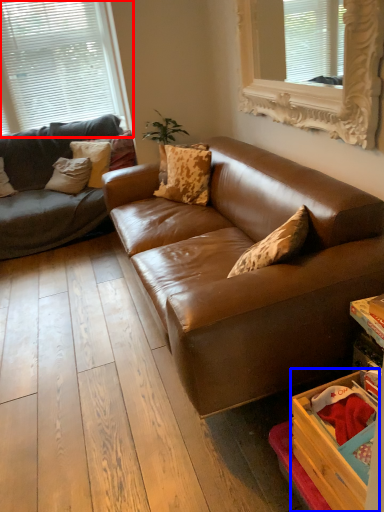
Question: Which of the following is the closest to the observer, window (highlighted by a red box) or drawer (highlighted by a blue box)?

Choices:
 (A) window
 (B) drawer

Answer: (B)